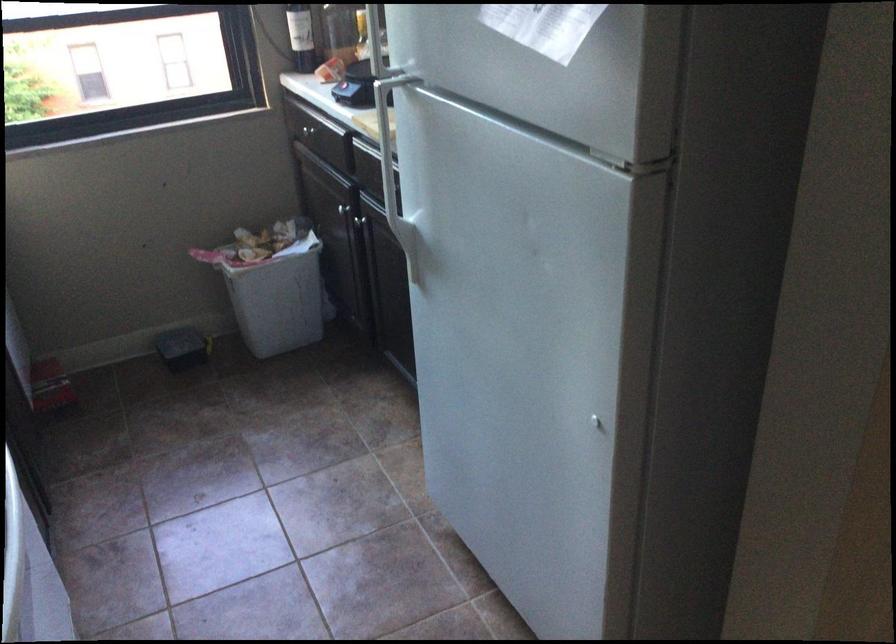
Find where to lift the wine bottle. Please return your answer as a coordinate pair (x, y).

(300, 37)